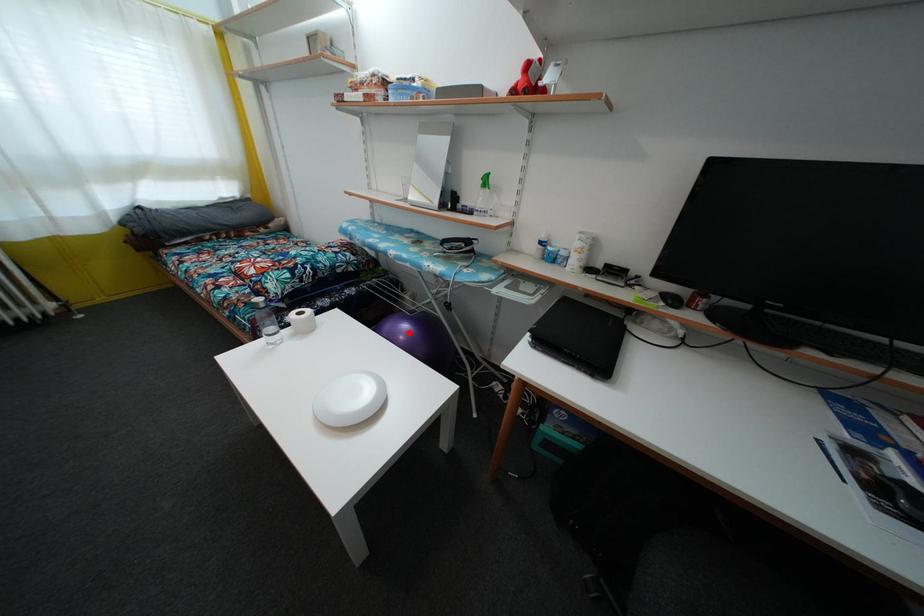
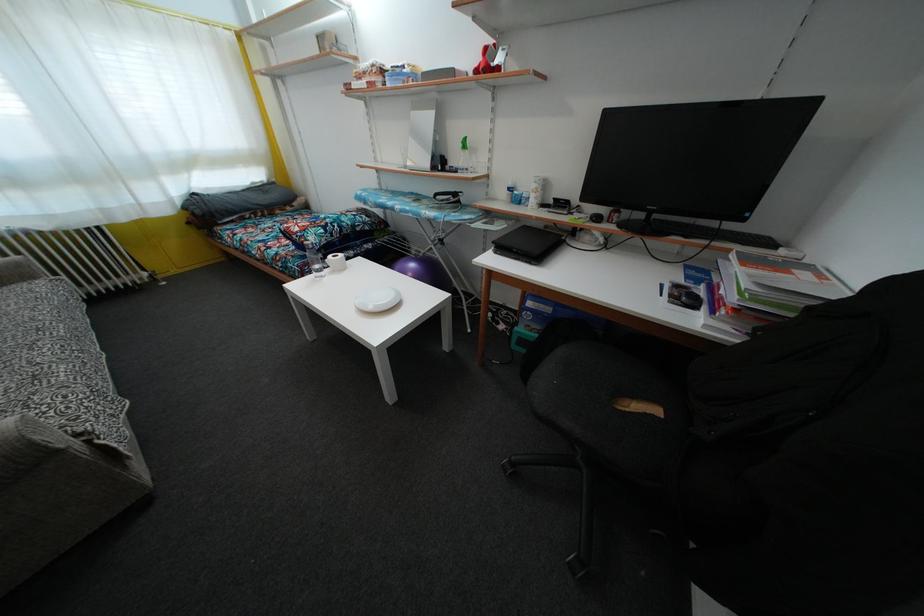
In the second image, find the point that corresponds to the highlighted location in the first image.

(416, 272)